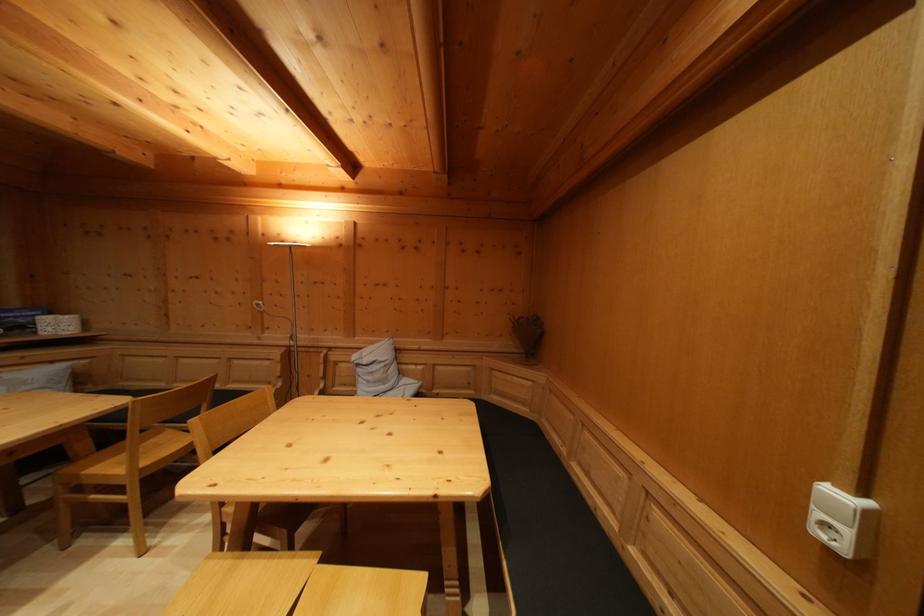
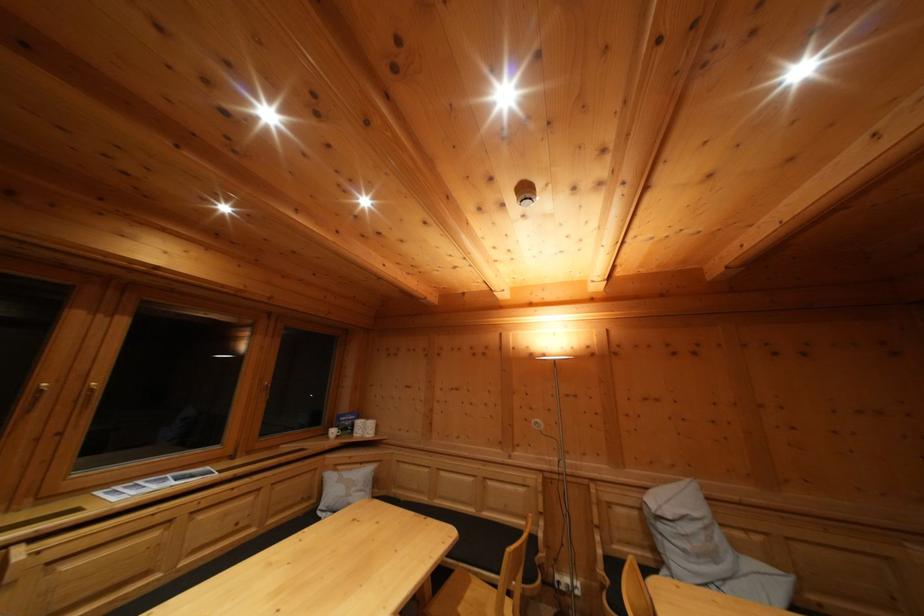
Find the pixel in the second image that matches point 274,390 in the first image.

(532, 525)